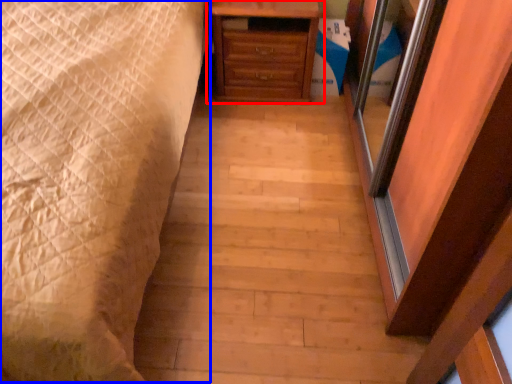
Question: Which of the following is the closest to the observer, chest of drawers (highlighted by a red box) or bed (highlighted by a blue box)?

Choices:
 (A) chest of drawers
 (B) bed

Answer: (B)